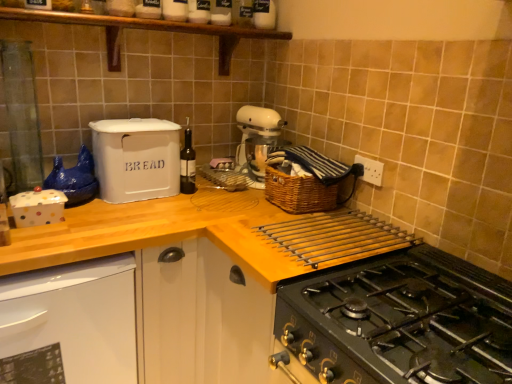
At what (x,y) coordinates should I click in order to perform the action: click on vacant area to the right of white matte bread bin at upper left. Please return your answer as a coordinate pair (x, y). This screenshot has height=384, width=512. Looking at the image, I should click on (193, 200).